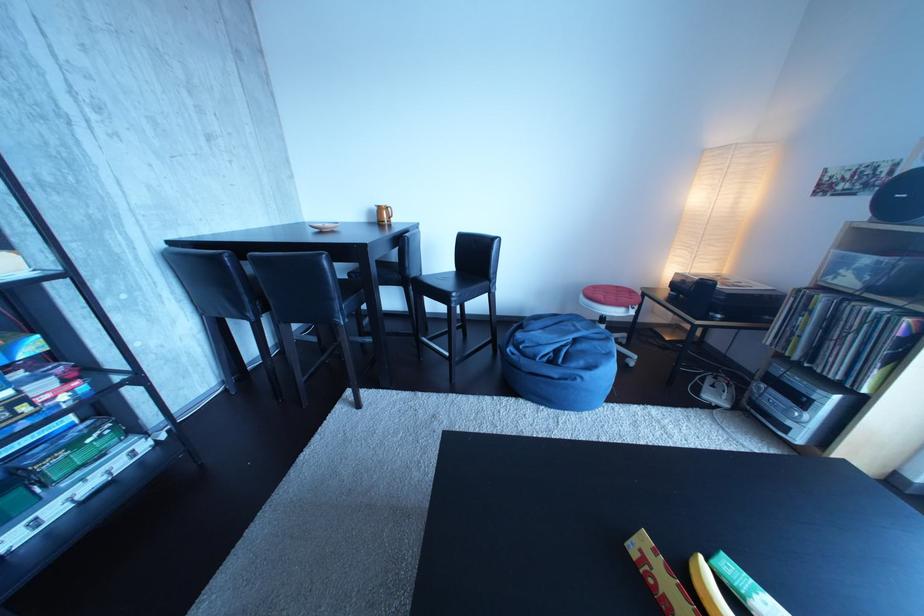
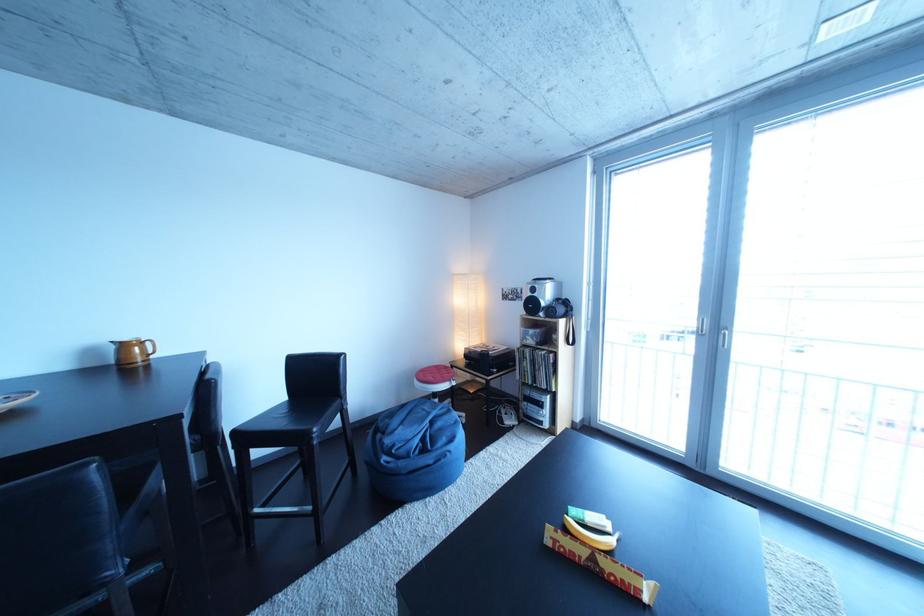
Where in the second image is the point corresponding to the point at 594,302 from the first image?

(430, 387)